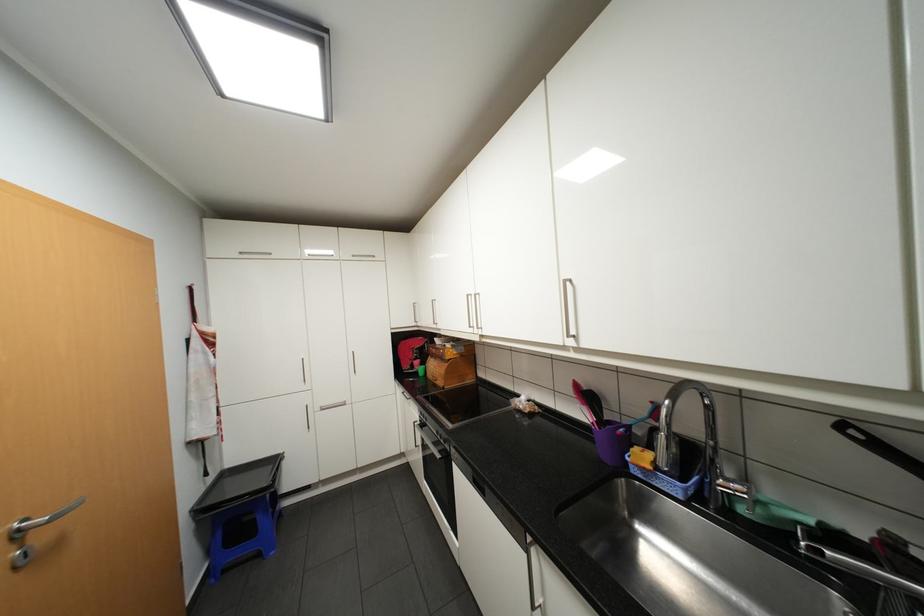
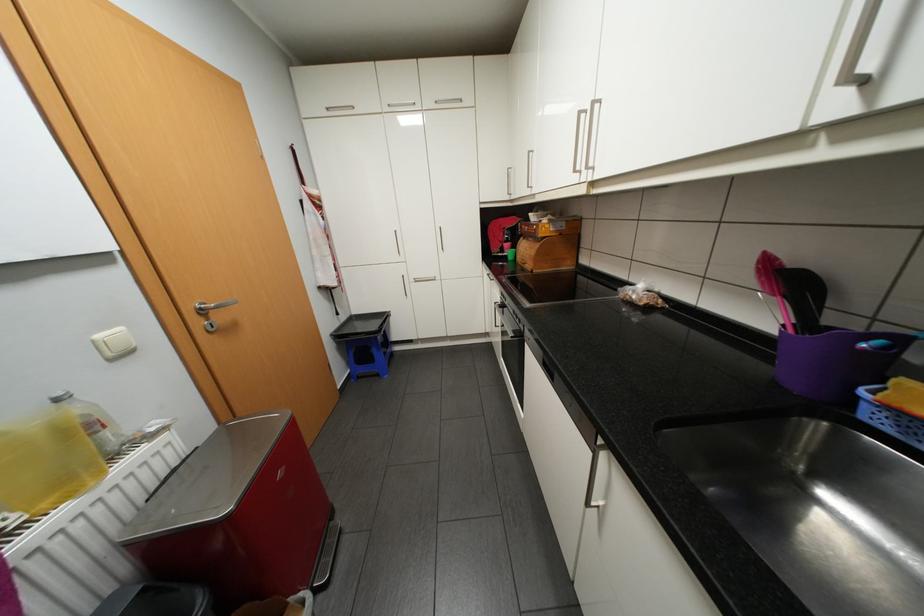
Find the pixel in the second image that matches pixel 27 530 in the first image.

(209, 308)